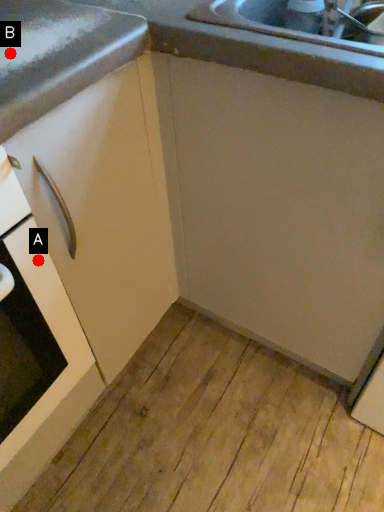
Question: Two points are circled on the image, labeled by A and B beside each circle. Which point appears closest to the camera in this image?

Choices:
 (A) A is closer
 (B) B is closer

Answer: (B)